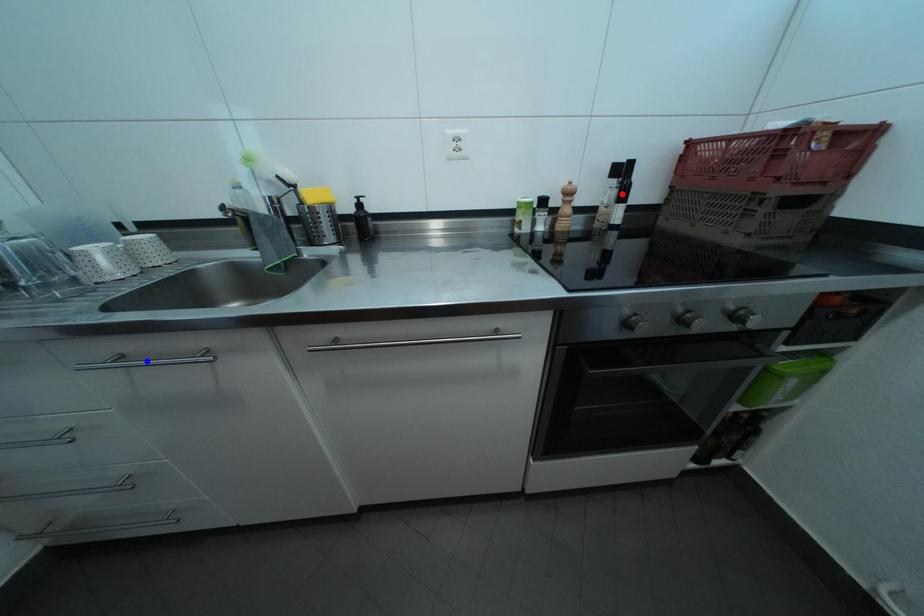
Question: Two points are marked on the image. Which point is closer to the camera?

Choices:
 (A) Blue point is closer.
 (B) Red point is closer.

Answer: (A)